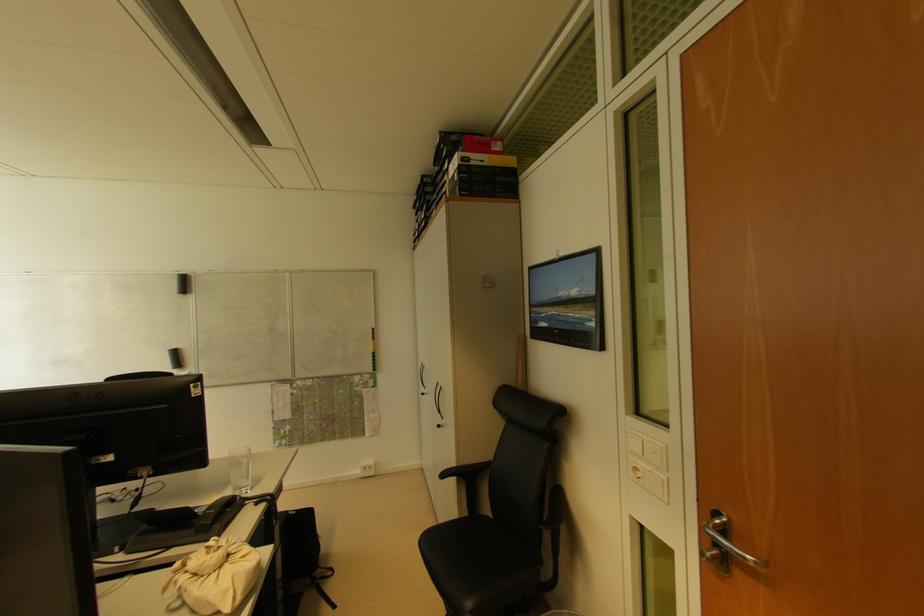
Where is `black chair sitting surface`? black chair sitting surface is located at coordinates (478, 565).